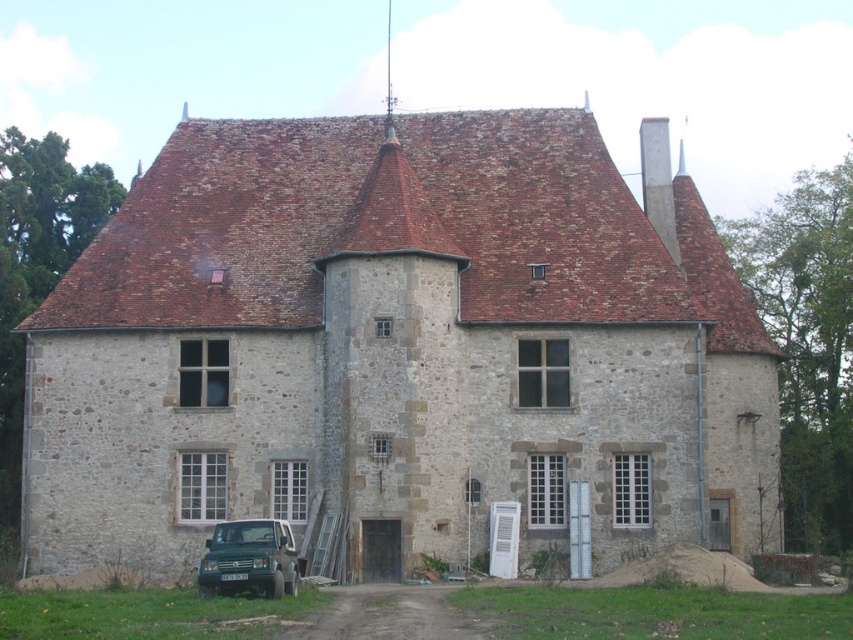
Question: Does green matte suv at lower center appear under white concrete chimney at upper center?

Choices:
 (A) yes
 (B) no

Answer: (A)

Question: Which of the following is the farthest from the observer?

Choices:
 (A) green matte suv at lower center
 (B) white concrete chimney at upper center

Answer: (B)

Question: From the image, what is the correct spatial relationship of green matte suv at lower center in relation to white concrete chimney at upper center?

Choices:
 (A) below
 (B) above

Answer: (A)

Question: Which point is closer to the camera?

Choices:
 (A) (645, 148)
 (B) (218, 582)

Answer: (B)

Question: Which point appears closest to the camera in this image?

Choices:
 (A) (283, 548)
 (B) (643, 138)

Answer: (A)

Question: Does green matte suv at lower center have a greater width compared to white concrete chimney at upper center?

Choices:
 (A) yes
 (B) no

Answer: (B)